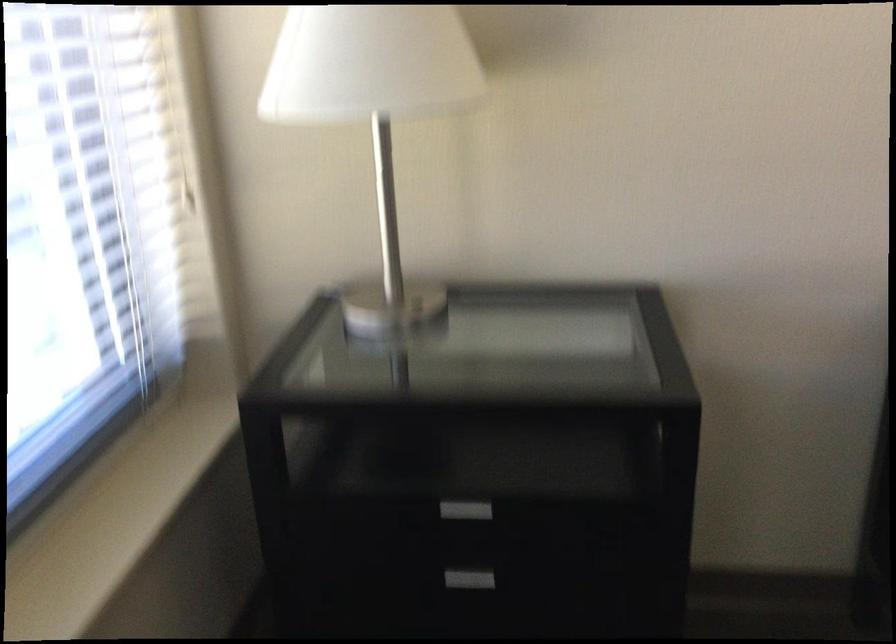
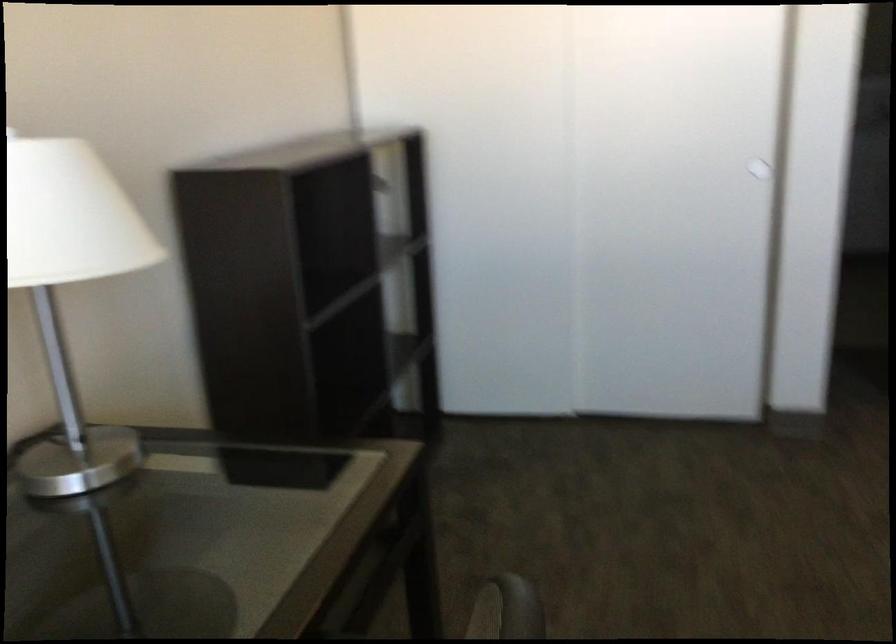
Question: The camera is either moving clockwise (left) or counter-clockwise (right) around the object. The first image is from the beginning of the video and the second image is from the end. Is the camera moving left or right when shooting the video?

Choices:
 (A) Left
 (B) Right

Answer: (A)